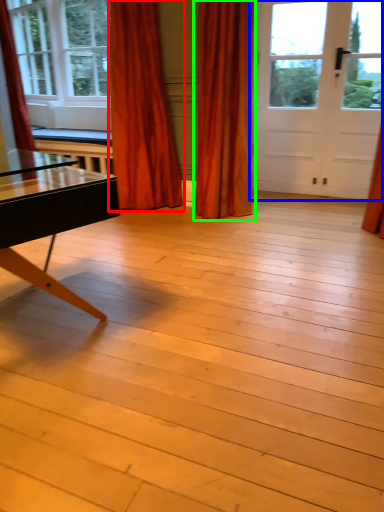
Question: Based on their relative distances, which object is nearer to curtain (highlighted by a red box)? Choose from door (highlighted by a blue box) and curtain (highlighted by a green box).

Choices:
 (A) door
 (B) curtain

Answer: (B)